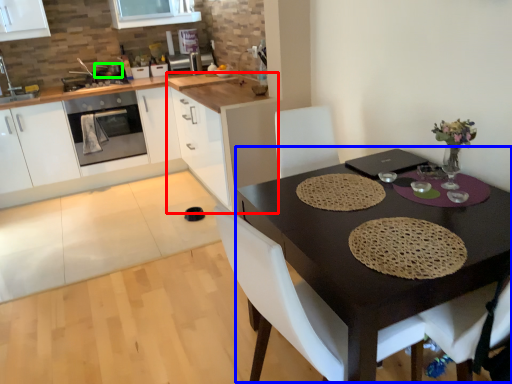
Question: Estimate the real-world distances between objects in this image. Which object is farther from cabinetry (highlighted by a red box), round table (highlighted by a blue box) or appliance (highlighted by a green box)?

Choices:
 (A) round table
 (B) appliance

Answer: (B)